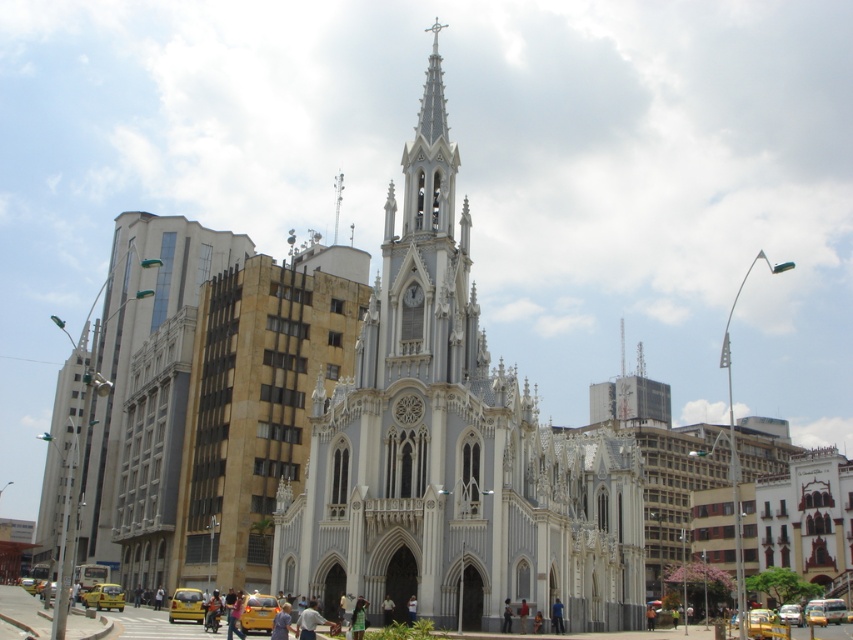
Question: Is white stone church steeple at center positioned at the back of smooth white spire at upper center?

Choices:
 (A) yes
 (B) no

Answer: (B)

Question: In this image, where is white stone church steeple at center located relative to smooth white spire at upper center?

Choices:
 (A) below
 (B) above

Answer: (A)

Question: Which object is farther from the camera taking this photo?

Choices:
 (A) white stone church steeple at center
 (B) smooth white spire at upper center

Answer: (B)

Question: Which point appears closest to the camera in this image?

Choices:
 (A) (386, 461)
 (B) (334, 195)

Answer: (A)

Question: Is white stone church steeple at center bigger than smooth white spire at upper center?

Choices:
 (A) no
 (B) yes

Answer: (B)